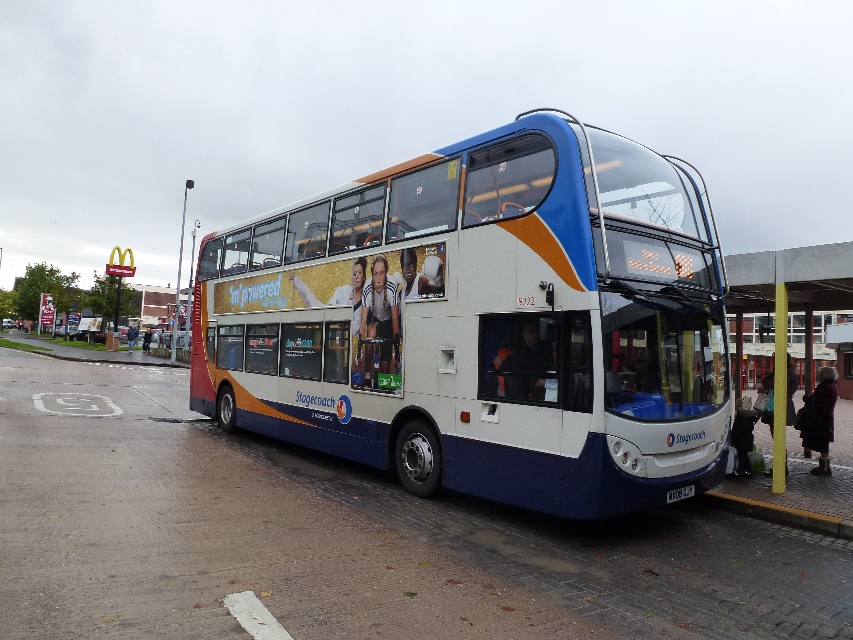
Question: Which object appears farthest from the camera in this image?

Choices:
 (A) white glossy decker bus at center
 (B) white plastic license plate at lower center

Answer: (B)

Question: Is white glossy decker bus at center wider than white plastic license plate at lower center?

Choices:
 (A) no
 (B) yes

Answer: (B)

Question: Which point is farther to the camera?

Choices:
 (A) (691, 484)
 (B) (635, 371)

Answer: (A)

Question: Does white glossy decker bus at center have a greater width compared to white plastic license plate at lower center?

Choices:
 (A) no
 (B) yes

Answer: (B)

Question: Can you confirm if white glossy decker bus at center is positioned to the left of white plastic license plate at lower center?

Choices:
 (A) yes
 (B) no

Answer: (A)